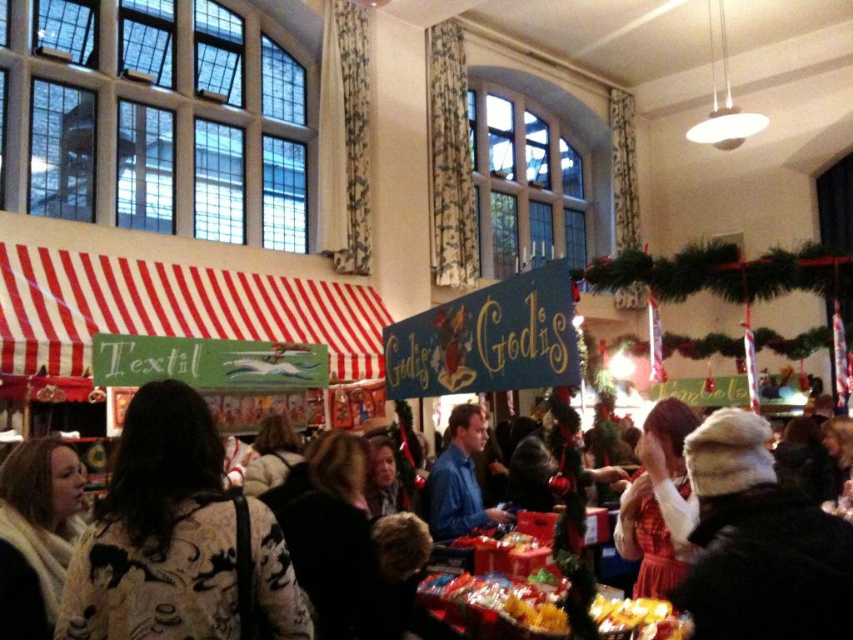
Question: Does fluffy white coat at center have a larger size compared to fur-lined hat at center?

Choices:
 (A) yes
 (B) no

Answer: (A)

Question: Observing the image, what is the correct spatial positioning of fluffy white coat at center in reference to white knit scarf at lower left?

Choices:
 (A) below
 (B) above

Answer: (B)

Question: Does white knit scarf at lower left lie in front of blue cotton shirt at center?

Choices:
 (A) no
 (B) yes

Answer: (B)

Question: Among these points, which one is nearest to the camera?

Choices:
 (A) (213, 499)
 (B) (740, 586)

Answer: (B)

Question: Which of these objects is positioned farthest from the fluffy white coat at center?

Choices:
 (A) blue cotton shirt at center
 (B) fur-lined hat at center
 (C) white knit scarf at lower left

Answer: (A)

Question: Which point appears farthest from the camera in this image?

Choices:
 (A) (848, 616)
 (B) (19, 460)
 (C) (166, 545)
 (D) (474, 428)

Answer: (D)